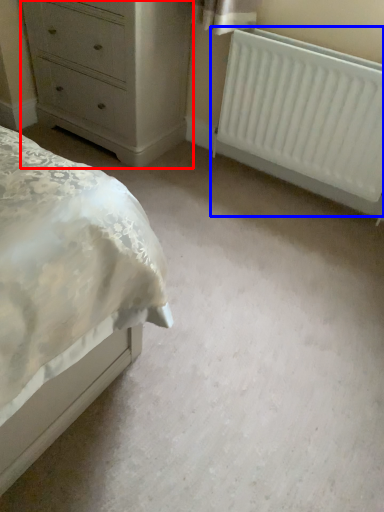
Question: Which object is closer to the camera taking this photo, chest of drawers (highlighted by a red box) or radiator (highlighted by a blue box)?

Choices:
 (A) chest of drawers
 (B) radiator

Answer: (B)